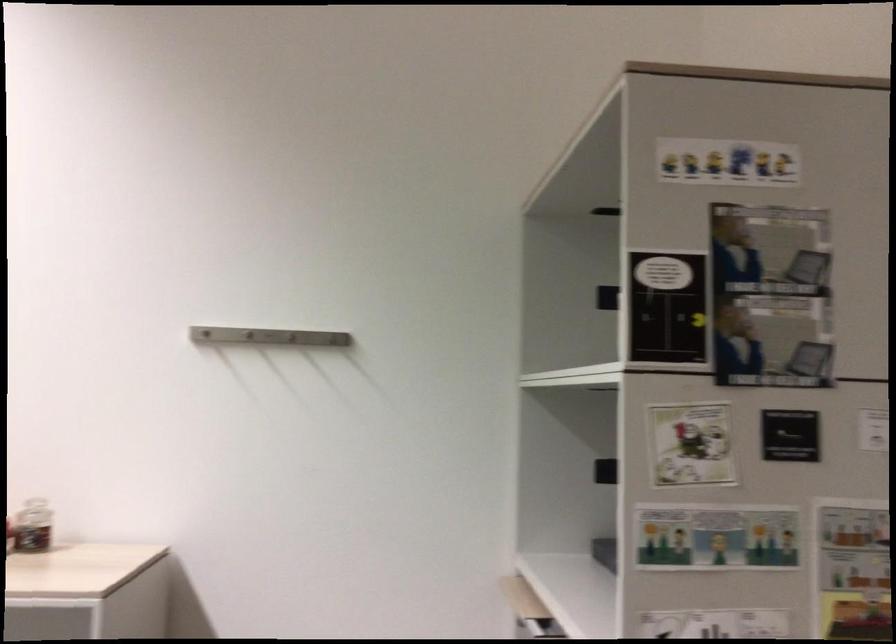
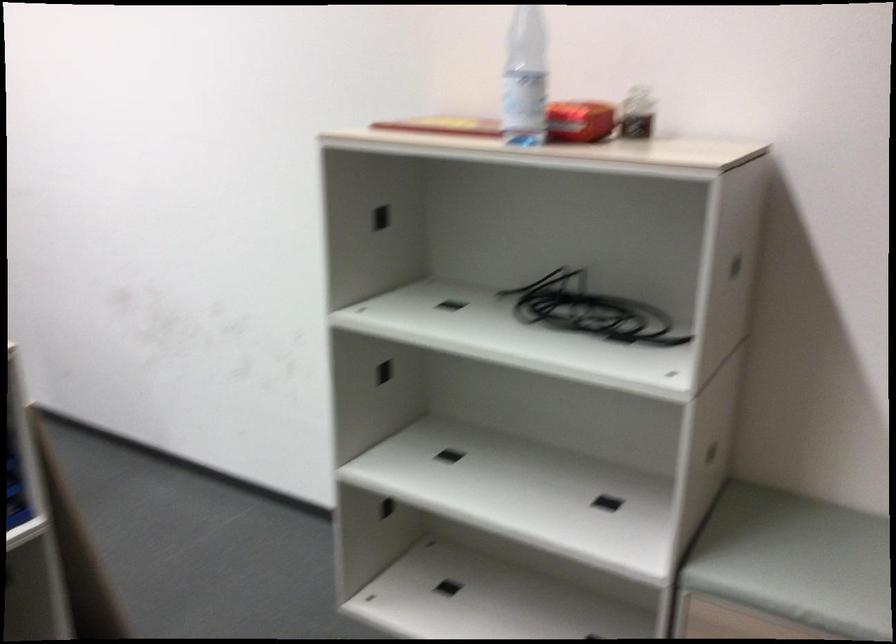
How did the camera likely rotate?

The rotation direction of the camera is left-down.